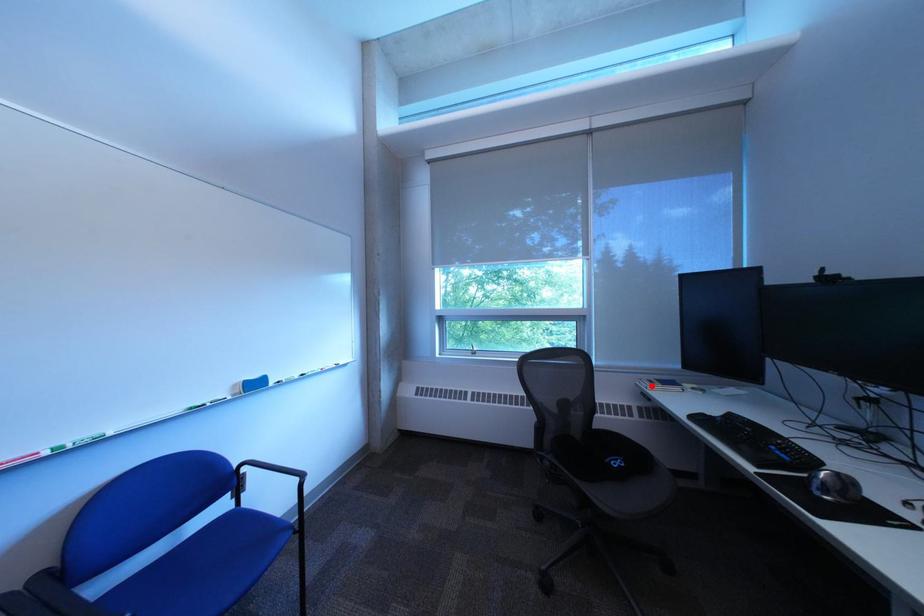
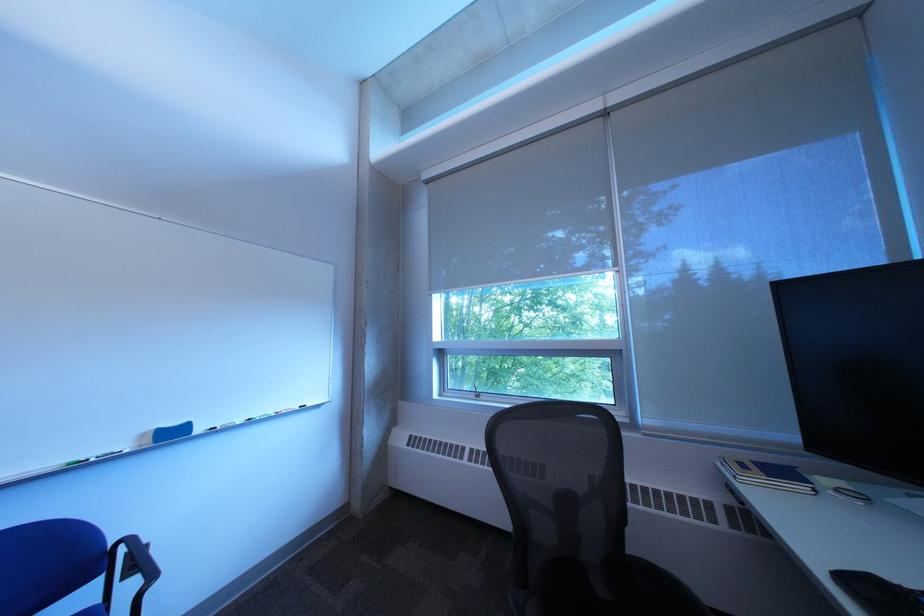
Question: I am providing you with two images of the same scene from different viewpoints. A red point is shown in image1. For the corresponding object point in image2, is it positioned nearer or farther from the camera?

Choices:
 (A) Nearer
 (B) Farther

Answer: (A)